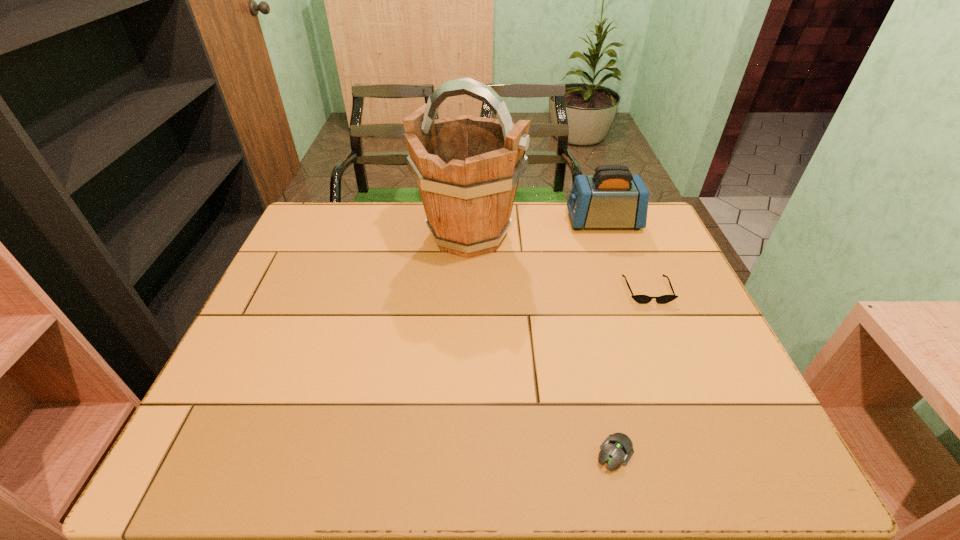
Locate an element on the screen. The width and height of the screenshot is (960, 540). free location located 0.360m on the front-facing side of the third shortest object is located at coordinates (457, 222).

The height and width of the screenshot is (540, 960). What are the coordinates of `vacant space located on the front-facing side of the third tallest object` in the screenshot? It's located at (663, 330).

Locate an element on the screen. free region located on the back of the shortest object is located at coordinates (592, 358).

Image resolution: width=960 pixels, height=540 pixels. Identify the location of bucket situated at the far edge. (467, 168).

You are a GUI agent. You are given a task and a screenshot of the screen. Output one action in this format:
    pyautogui.click(x=<x>, y=<y>)
    Task: Click on the toaster situated at the far edge
    The height and width of the screenshot is (540, 960).
    Given the screenshot: What is the action you would take?
    pyautogui.click(x=611, y=198)

Identify the location of object located at the near edge. The width and height of the screenshot is (960, 540). (617, 448).

Where is `toaster that is at the right edge`? The width and height of the screenshot is (960, 540). toaster that is at the right edge is located at coordinates (611, 198).

Where is `sunglasses positioned at the right edge`? This screenshot has height=540, width=960. sunglasses positioned at the right edge is located at coordinates (641, 299).

Where is `object at the far right corner`? object at the far right corner is located at coordinates (611, 198).

Identify the location of vacant space at the far edge of the desktop. (393, 222).